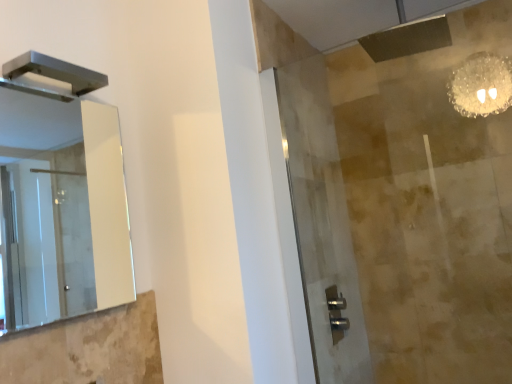
Question: Looking at their shapes, would you say metallic rectangular fixture at upper left is wider or thinner than clear glass mirror at left?

Choices:
 (A) wide
 (B) thin

Answer: (A)

Question: From the image's perspective, is metallic rectangular fixture at upper left positioned above or below clear glass mirror at left?

Choices:
 (A) below
 (B) above

Answer: (B)

Question: Estimate the real-world distances between objects in this image. Which object is farther from the clear glass mirror at left?

Choices:
 (A) metallic rectangular fixture at upper left
 (B) clear glass shower door at center

Answer: (A)

Question: Based on their relative distances, which object is farther from the clear glass mirror at left?

Choices:
 (A) clear glass shower door at center
 (B) metallic rectangular fixture at upper left

Answer: (B)